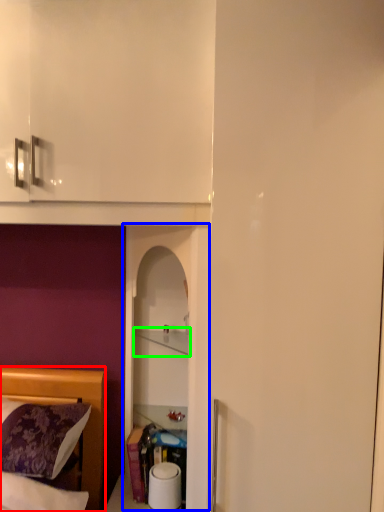
Question: Which is farther away from bed (highlighted by a red box)? glass door (highlighted by a blue box) or cabinet (highlighted by a green box)?

Choices:
 (A) glass door
 (B) cabinet

Answer: (B)